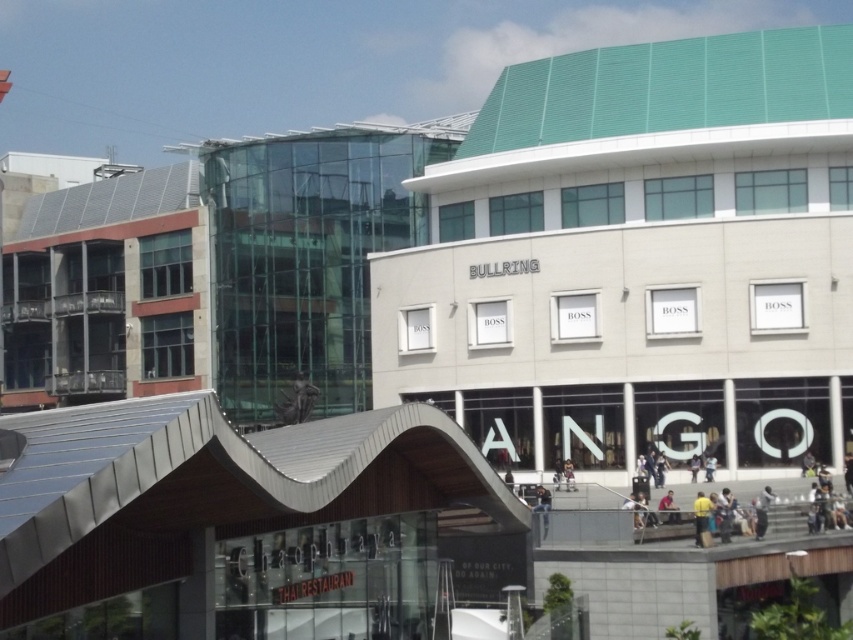
Question: Based on their relative distances, which object is nearer to the light brown leather jacket at lower right?

Choices:
 (A) yellow shirt at lower right
 (B) light brown leather jacket at lower center
 (C) light gray fabric jacket at lower right
 (D) dark gray fabric jacket at lower right

Answer: (D)

Question: Which object is closer to the camera taking this photo?

Choices:
 (A) light brown leather jacket at center
 (B) light brown leather jacket at lower center
 (C) dark gray fabric jacket at lower right

Answer: (B)

Question: Does light brown leather jacket at lower center have a smaller size compared to light brown leather jacket at lower right?

Choices:
 (A) no
 (B) yes

Answer: (A)

Question: Which point appears closest to the camera in this image?

Choices:
 (A) (692, 458)
 (B) (566, 472)

Answer: (A)

Question: Is light brown leather jacket at center bigger than dark blue jeans at center?

Choices:
 (A) no
 (B) yes

Answer: (A)

Question: Considering the relative positions of dark gray fabric jacket at lower right and light brown leather jacket at center in the image provided, where is dark gray fabric jacket at lower right located with respect to light brown leather jacket at center?

Choices:
 (A) left
 (B) right

Answer: (B)